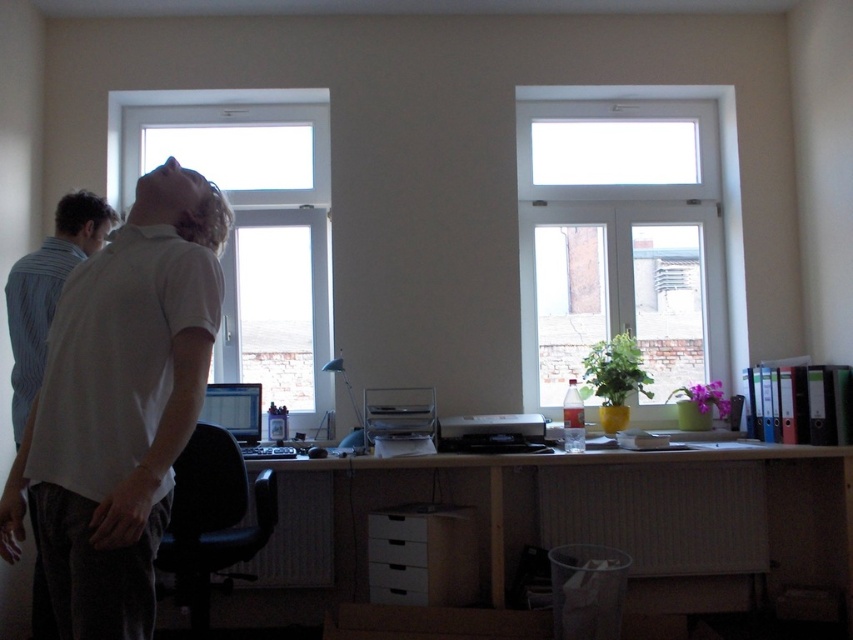
Can you confirm if transparent glass window at upper left is bigger than matte black monitor at center?

Indeed, transparent glass window at upper left has a larger size compared to matte black monitor at center.

Who is positioned more to the left, transparent glass window at upper left or matte black monitor at center?

Positioned to the left is transparent glass window at upper left.

Who is more forward, (186, 154) or (276, 456)?

Point (276, 456) is in front.

What are the coordinates of `transparent glass window at upper left` in the screenshot? It's located at (252, 224).

Who is lower down, white glossy computer desk at center or transparent glass window at upper left?

white glossy computer desk at center

Does white glossy computer desk at center have a greater height compared to transparent glass window at upper left?

In fact, white glossy computer desk at center may be shorter than transparent glass window at upper left.

Locate an element on the screen. The width and height of the screenshot is (853, 640). white glossy computer desk at center is located at coordinates (621, 508).

What are the coordinates of `white glossy computer desk at center` in the screenshot? It's located at (621, 508).

Does transparent glass window at upper center have a greater height compared to white glossy computer desk at center?

Yes.

Is transparent glass window at upper center to the right of white glossy computer desk at center from the viewer's perspective?

Yes, transparent glass window at upper center is to the right of white glossy computer desk at center.

Locate an element on the screen. Image resolution: width=853 pixels, height=640 pixels. transparent glass window at upper center is located at coordinates (622, 234).